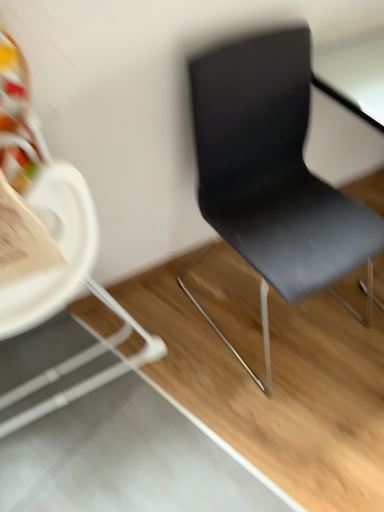
The height and width of the screenshot is (512, 384). Describe the element at coordinates (273, 174) in the screenshot. I see `matte black chair at right, arranged as the first chair when viewed from the right` at that location.

The width and height of the screenshot is (384, 512). Identify the location of matte black chair at right, arranged as the first chair when viewed from the right. (273, 174).

The height and width of the screenshot is (512, 384). What do you see at coordinates (61, 307) in the screenshot?
I see `matte black chair at right, which ranks as the first chair in left-to-right order` at bounding box center [61, 307].

This screenshot has width=384, height=512. I want to click on matte black chair at right, which ranks as the first chair in left-to-right order, so click(61, 307).

Identify the location of matte black chair at right, the second chair positioned from the left. tap(273, 174).

Is matte black chair at right, arranged as the first chair when viewed from the right, at the right side of matte black chair at right, which ranks as the first chair in left-to-right order?

Yes, matte black chair at right, arranged as the first chair when viewed from the right, is to the right of matte black chair at right, which ranks as the first chair in left-to-right order.

Based on the photo, relative to matte black chair at right, which ranks as the first chair in left-to-right order, is matte black chair at right, arranged as the first chair when viewed from the right, in front or behind?

matte black chair at right, arranged as the first chair when viewed from the right, is positioned farther from the viewer than matte black chair at right, which ranks as the first chair in left-to-right order.

Considering the positions of points (295, 245) and (74, 321), is point (295, 245) closer to camera compared to point (74, 321)?

Yes, point (295, 245) is in front of point (74, 321).

From the image's perspective, is matte black chair at right, the second chair positioned from the left, over matte black chair at right, which ranks as the first chair in left-to-right order?

Indeed, from the image's perspective, matte black chair at right, the second chair positioned from the left, is shown above matte black chair at right, which ranks as the first chair in left-to-right order.

From a real-world perspective, which object stands above the other?

In real-world perspective, matte black chair at right, which ranks as the first chair in left-to-right order, is above.

Between matte black chair at right, arranged as the first chair when viewed from the right, and matte black chair at right, which ranks as the first chair in left-to-right order, which one has smaller width?

matte black chair at right, which ranks as the first chair in left-to-right order, is thinner.

Between matte black chair at right, the second chair positioned from the left, and matte black chair at right, which is the second chair in right-to-left order, which one has less height?

With less height is matte black chair at right, the second chair positioned from the left.

Is matte black chair at right, arranged as the first chair when viewed from the right, smaller than matte black chair at right, which ranks as the first chair in left-to-right order?

Indeed, matte black chair at right, arranged as the first chair when viewed from the right, has a smaller size compared to matte black chair at right, which ranks as the first chair in left-to-right order.

Could matte black chair at right, which is the second chair in right-to-left order, be considered to be inside matte black chair at right, the second chair positioned from the left?

No, matte black chair at right, which is the second chair in right-to-left order, is not surrounded by matte black chair at right, the second chair positioned from the left.

Are matte black chair at right, the second chair positioned from the left, and matte black chair at right, which ranks as the first chair in left-to-right order, far apart?

No, there isn't a large distance between matte black chair at right, the second chair positioned from the left, and matte black chair at right, which ranks as the first chair in left-to-right order.

Could you tell me if matte black chair at right, the second chair positioned from the left, is facing matte black chair at right, which ranks as the first chair in left-to-right order?

No.

Find the location of a particular element. chair located in front of the matte black chair at right, the second chair positioned from the left is located at coordinates (61, 307).

Which object is positioned more to the left, matte black chair at right, which ranks as the first chair in left-to-right order, or matte black chair at right, arranged as the first chair when viewed from the right?

matte black chair at right, which ranks as the first chair in left-to-right order.

Is matte black chair at right, which is the second chair in right-to-left order, in front of or behind matte black chair at right, arranged as the first chair when viewed from the right, in the image?

Visually, matte black chair at right, which is the second chair in right-to-left order, is located in front of matte black chair at right, arranged as the first chair when viewed from the right.

Is point (27, 307) closer or farther from the camera than point (280, 69)?

Clearly, point (27, 307) is closer to the camera than point (280, 69).

From the image's perspective, which one is positioned lower, matte black chair at right, which ranks as the first chair in left-to-right order, or matte black chair at right, the second chair positioned from the left?

From the image's view, matte black chair at right, which ranks as the first chair in left-to-right order, is below.

From a real-world perspective, is matte black chair at right, which is the second chair in right-to-left order, positioned over matte black chair at right, the second chair positioned from the left, based on gravity?

Yes, from a real-world perspective, matte black chair at right, which is the second chair in right-to-left order, is above matte black chair at right, the second chair positioned from the left.

Is matte black chair at right, which is the second chair in right-to-left order, wider than matte black chair at right, the second chair positioned from the left?

No, matte black chair at right, which is the second chair in right-to-left order, is not wider than matte black chair at right, the second chair positioned from the left.

Can you confirm if matte black chair at right, which ranks as the first chair in left-to-right order, is shorter than matte black chair at right, arranged as the first chair when viewed from the right?

Incorrect, the height of matte black chair at right, which ranks as the first chair in left-to-right order, does not fall short of that of matte black chair at right, arranged as the first chair when viewed from the right.

Considering the sizes of matte black chair at right, which is the second chair in right-to-left order, and matte black chair at right, the second chair positioned from the left, in the image, is matte black chair at right, which is the second chair in right-to-left order, bigger or smaller than matte black chair at right, the second chair positioned from the left,?

In the image, matte black chair at right, which is the second chair in right-to-left order, appears to be larger than matte black chair at right, the second chair positioned from the left.

Is matte black chair at right, which is the second chair in right-to-left order, located outside matte black chair at right, arranged as the first chair when viewed from the right?

matte black chair at right, which is the second chair in right-to-left order, is positioned outside matte black chair at right, arranged as the first chair when viewed from the right.

Is matte black chair at right, which ranks as the first chair in left-to-right order, touching matte black chair at right, the second chair positioned from the left?

matte black chair at right, which ranks as the first chair in left-to-right order, is not next to matte black chair at right, the second chair positioned from the left, and they're not touching.

Could you tell me if matte black chair at right, which ranks as the first chair in left-to-right order, is turned towards matte black chair at right, arranged as the first chair when viewed from the right?

No, matte black chair at right, which ranks as the first chair in left-to-right order, is not turned towards matte black chair at right, arranged as the first chair when viewed from the right.

Measure the distance between matte black chair at right, which is the second chair in right-to-left order, and matte black chair at right, the second chair positioned from the left.

The distance of matte black chair at right, which is the second chair in right-to-left order, from matte black chair at right, the second chair positioned from the left, is 22.22 inches.

Identify the location of chair on the left side of matte black chair at right, arranged as the first chair when viewed from the right. This screenshot has width=384, height=512. (61, 307).

Where is `chair located above the matte black chair at right, arranged as the first chair when viewed from the right (from a real-world perspective)`? Image resolution: width=384 pixels, height=512 pixels. chair located above the matte black chair at right, arranged as the first chair when viewed from the right (from a real-world perspective) is located at coordinates point(61,307).

Image resolution: width=384 pixels, height=512 pixels. In order to click on chair that is below the matte black chair at right, arranged as the first chair when viewed from the right (from the image's perspective) in this screenshot , I will do `click(61, 307)`.